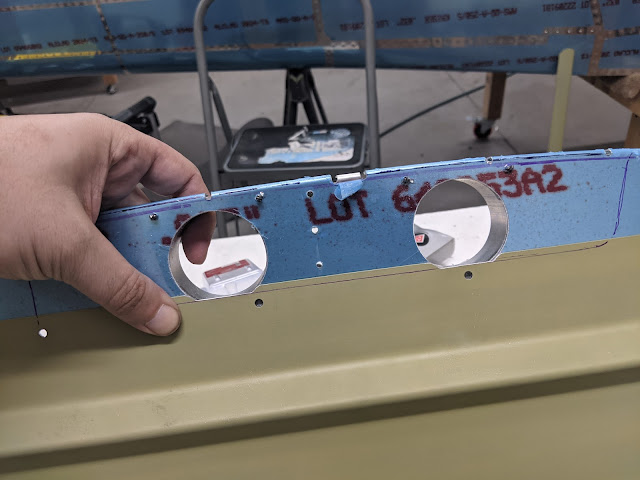
The image size is (640, 480). Find the location of `stair base of stool`. stair base of stool is located at coordinates (260, 154).